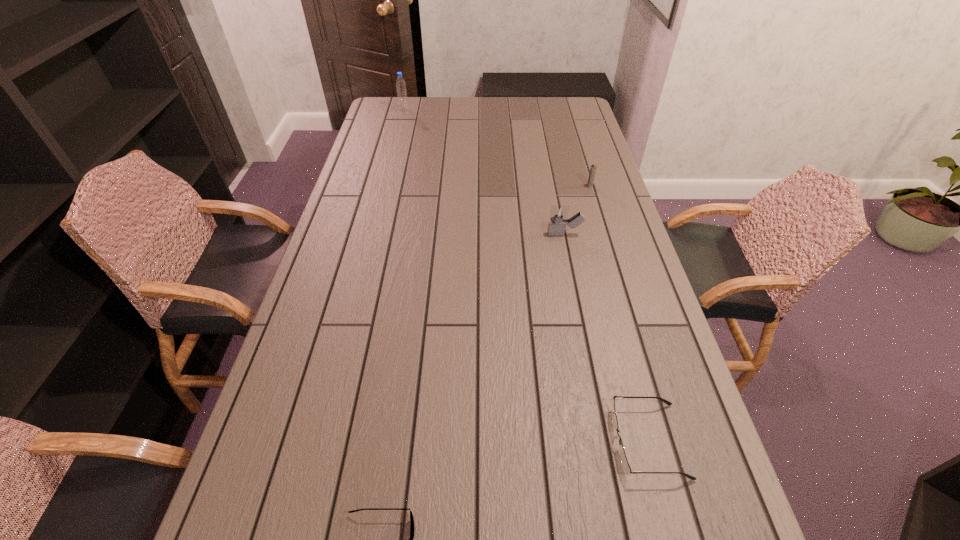
Image resolution: width=960 pixels, height=540 pixels. What are the coordinates of `empty location between the second tallest object and the third tallest object` in the screenshot? It's located at (577, 210).

Locate an element on the screen. object that is the third nearest to the leftmost object is located at coordinates (627, 469).

Select which object is the fourth closest to the farther spectacles. Please provide its 2D coordinates. Your answer should be formatted as a tuple, i.e. [(x, y)], where the tuple contains the x and y coordinates of a point satisfying the conditions above.

[(400, 83)]

Where is `free spot that satisfies the following two spatial constraints: 1. on the front side of the nearer igniter; 2. on the right side of the tallest object`? free spot that satisfies the following two spatial constraints: 1. on the front side of the nearer igniter; 2. on the right side of the tallest object is located at coordinates (372, 234).